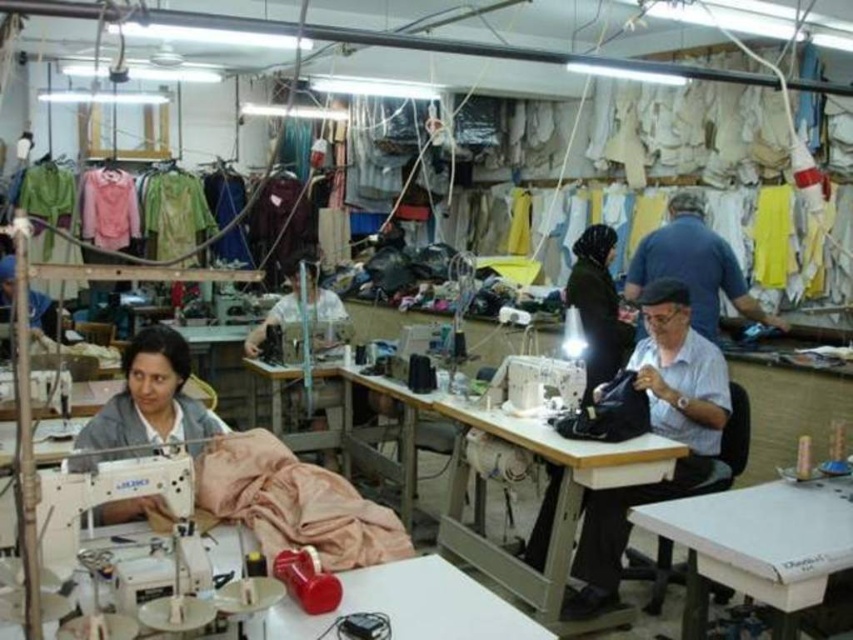
Does point (108, 448) lie behind point (590, 284)?

No.

Which is in front, point (166, 419) or point (616, 365)?

Point (166, 419) is more forward.

Who is more distant from viewer, (152, 378) or (624, 348)?

Point (624, 348)

Where is `matte gray sweater at left`? The image size is (853, 640). matte gray sweater at left is located at coordinates (146, 403).

Is point (657, 272) farther from viewer compared to point (592, 289)?

No, (657, 272) is closer to viewer.

Who is more distant from viewer, (694, 257) or (524, 561)?

Point (694, 257)

Is point (706, 273) positioned behind point (598, 332)?

No, it is not.

What are the coordinates of `blue cotton shirt at upper right` in the screenshot? It's located at (694, 266).

Is matte gray sweater at left wider than blue cotton shirt at upper right?

No.

Is the position of matte gray sweater at left less distant than that of blue cotton shirt at upper right?

Yes, it is in front of blue cotton shirt at upper right.

Is point (125, 369) farther from camera compared to point (647, 252)?

No, it is in front of (647, 252).

This screenshot has width=853, height=640. Find the location of `matte gray sweater at left`. matte gray sweater at left is located at coordinates 146,403.